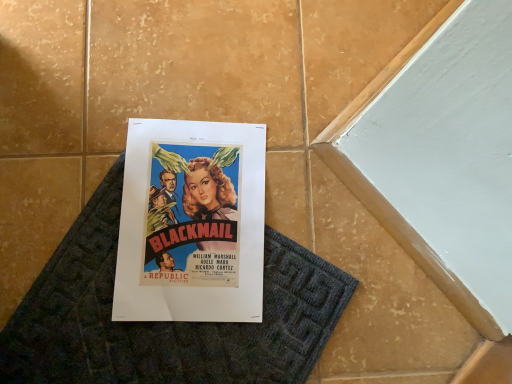
What do you see at coordinates (191, 223) in the screenshot? I see `matte paper poster at center` at bounding box center [191, 223].

What is the approximate width of matte paper poster at center?

matte paper poster at center is 11.69 inches wide.

You are a GUI agent. You are given a task and a screenshot of the screen. Output one action in this format:
    pyautogui.click(x=<x>, y=<y>)
    Task: Click on the matte paper poster at center
    
    Given the screenshot: What is the action you would take?
    pyautogui.click(x=191, y=223)

This screenshot has height=384, width=512. Find the location of `matte paper poster at center`. matte paper poster at center is located at coordinates (191, 223).